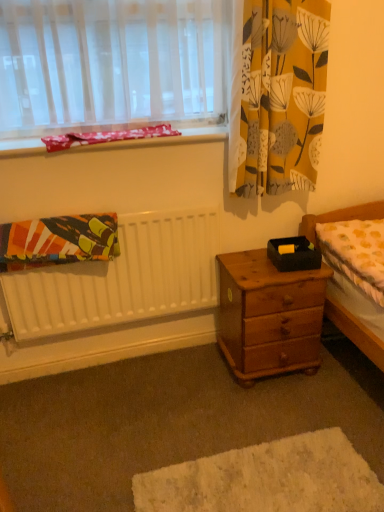
The width and height of the screenshot is (384, 512). I want to click on free space in front of wooden nightstand at center, so click(x=277, y=414).